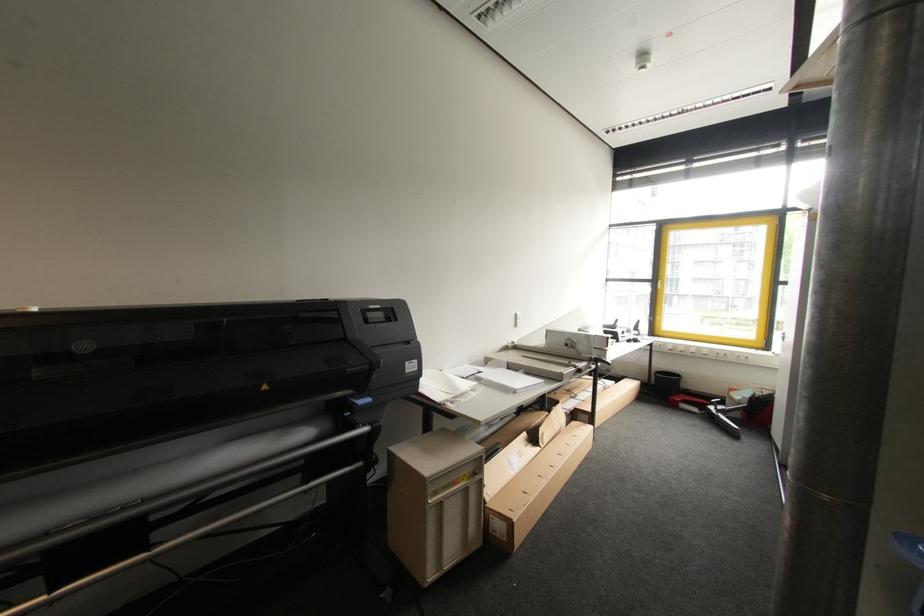
Identify the location of window handle. (666, 290).